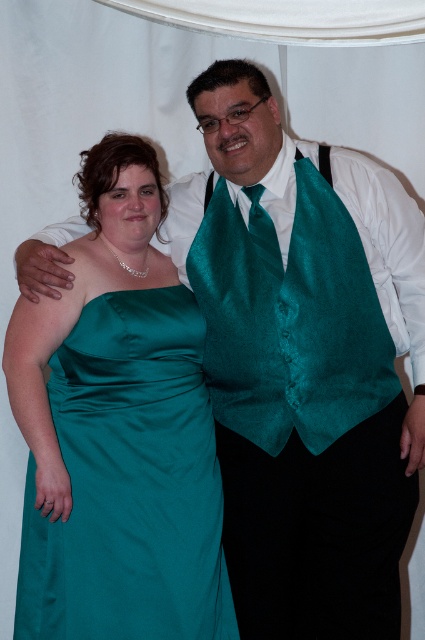
Does teal satin vest at center appear over teal satin tie at center?

Actually, teal satin vest at center is below teal satin tie at center.

Can you confirm if teal satin vest at center is positioned to the right of teal satin tie at center?

Correct, you'll find teal satin vest at center to the right of teal satin tie at center.

Is point (342, 324) farther from camera compared to point (266, 228)?

No, (342, 324) is in front of (266, 228).

This screenshot has width=425, height=640. I want to click on teal satin vest at center, so click(x=291, y=321).

Does satin teal dress at center have a smaller size compared to teal satin tie at center?

Incorrect, satin teal dress at center is not smaller in size than teal satin tie at center.

Does satin teal dress at center have a greater width compared to teal satin tie at center?

Yes, satin teal dress at center is wider than teal satin tie at center.

Where is `satin teal dress at center`? This screenshot has width=425, height=640. satin teal dress at center is located at coordinates (130, 483).

Find the location of `satin teal dress at center`. satin teal dress at center is located at coordinates (130, 483).

Which is below, satin teal dress at center or teal satin vest at center?

satin teal dress at center is lower down.

Consider the image. How far apart are satin teal dress at center and teal satin vest at center?

The distance of satin teal dress at center from teal satin vest at center is 11.03 inches.

Does point (67, 593) come in front of point (280, 426)?

Yes, it is in front of point (280, 426).

Where is `satin teal dress at center`? The image size is (425, 640). satin teal dress at center is located at coordinates coord(130,483).